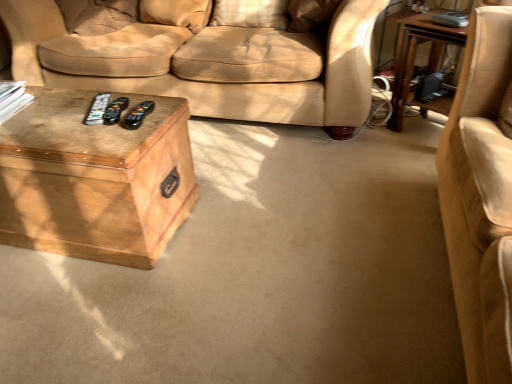
At what (x,y) coordinates should I click in order to perform the action: click on space that is in front of black plastic remote at center, the 2th remote viewed from the left. Please return your answer as a coordinate pair (x, y). Looking at the image, I should click on (115, 132).